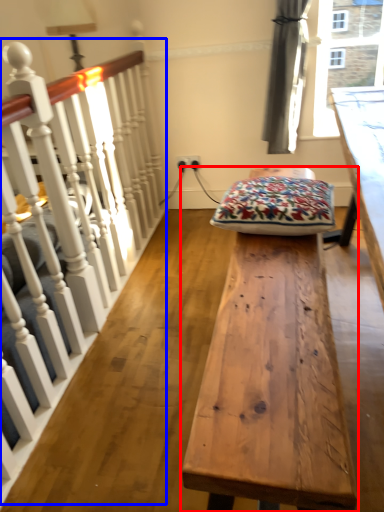
Question: Which object is closer to the camera taking this photo, table (highlighted by a red box) or rail (highlighted by a blue box)?

Choices:
 (A) table
 (B) rail

Answer: (B)